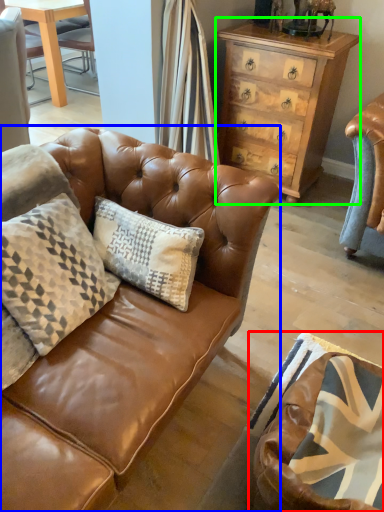
Question: Considering the real-world distances, which object is farthest from swivel chair (highlighted by a red box)? studio couch (highlighted by a blue box) or chest of drawers (highlighted by a green box)?

Choices:
 (A) studio couch
 (B) chest of drawers

Answer: (B)